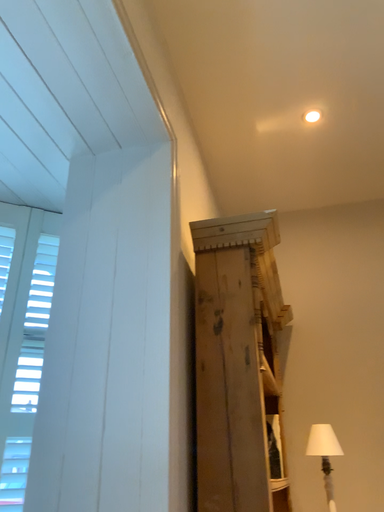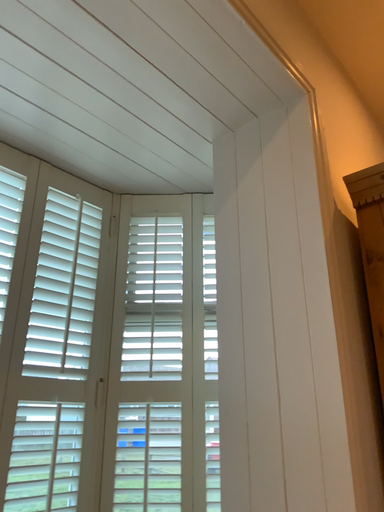
Question: Which way did the camera rotate in the video?

Choices:
 (A) rotated right
 (B) rotated left

Answer: (B)